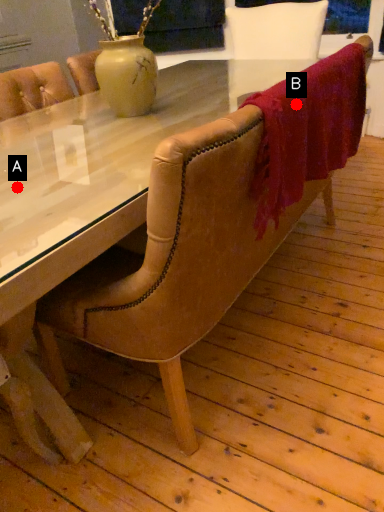
Question: Two points are circled on the image, labeled by A and B beside each circle. Among these points, which one is farthest from the camera?

Choices:
 (A) A is further
 (B) B is further

Answer: (A)